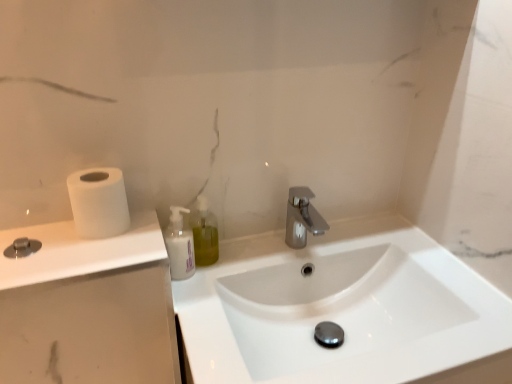
The height and width of the screenshot is (384, 512). Find the location of `translucent plastic soap dispenser at center`. translucent plastic soap dispenser at center is located at coordinates (204, 233).

Measure the distance between point (286, 243) and camera.

Point (286, 243) and camera are 3.32 feet apart.

Where is `white matte toilet paper at left`? This screenshot has height=384, width=512. white matte toilet paper at left is located at coordinates (98, 202).

Is polished chrome faucet at center next to white matte bottle at center?

polished chrome faucet at center is not next to white matte bottle at center, and they're not touching.

Can you confirm if polished chrome faucet at center is smaller than white matte bottle at center?

No.

Considering the sizes of objects polished chrome faucet at center and white matte bottle at center in the image provided, who is shorter, polished chrome faucet at center or white matte bottle at center?

Standing shorter between the two is polished chrome faucet at center.

Image resolution: width=512 pixels, height=384 pixels. Find the location of `tap directly beneath the white matte bottle at center (from a real-world perspective)`. tap directly beneath the white matte bottle at center (from a real-world perspective) is located at coordinates (302, 218).

You are a GUI agent. You are given a task and a screenshot of the screen. Output one action in this format:
    pyautogui.click(x=<x>, y=<y>)
    Task: Click on the sink that appears below the white matte bottle at center (from a real-world perspective)
    
    Given the screenshot: What is the action you would take?
    pyautogui.click(x=343, y=310)

Is white glossy sink at center facing towards white matte bottle at center?

No, white glossy sink at center is not aimed at white matte bottle at center.

Is white glossy sink at center bigger than white matte bottle at center?

Yes.

Can you confirm if white glossy sink at center is thinner than white matte bottle at center?

No.

Who is taller, polished chrome faucet at center or white glossy sink at center?

Standing taller between the two is white glossy sink at center.

The height and width of the screenshot is (384, 512). I want to click on tap behind the white glossy sink at center, so click(x=302, y=218).

Does point (300, 238) come in front of point (194, 333)?

No, it is behind (194, 333).

From a real-world perspective, is polished chrome faucet at center above or below white glossy sink at center?

Clearly, from a real-world perspective, polished chrome faucet at center is above white glossy sink at center.

Between white matte toilet paper at left and white matte countertop at left, which one has larger width?

white matte countertop at left is wider.

From the image's perspective, does white matte toilet paper at left appear lower than white matte countertop at left?

Actually, white matte toilet paper at left appears above white matte countertop at left in the image.

Considering the sizes of white matte toilet paper at left and white matte countertop at left in the image, is white matte toilet paper at left taller or shorter than white matte countertop at left?

Clearly, white matte toilet paper at left is shorter compared to white matte countertop at left.

Does white matte countertop at left appear on the left side of white matte bottle at center?

Yes.

Looking at this image, is white matte countertop at left inside or outside of white matte bottle at center?

white matte countertop at left lies outside white matte bottle at center.

Where is `mouthwash above the white matte countertop at left (from a real-world perspective)`? mouthwash above the white matte countertop at left (from a real-world perspective) is located at coordinates (179, 245).

Considering the sizes of white matte countertop at left and white matte bottle at center in the image, is white matte countertop at left bigger or smaller than white matte bottle at center?

Considering their sizes, white matte countertop at left takes up more space than white matte bottle at center.

Can you confirm if white matte bottle at center is bigger than translucent plastic soap dispenser at center?

Yes, white matte bottle at center is bigger than translucent plastic soap dispenser at center.

Considering the relative positions of white matte bottle at center and translucent plastic soap dispenser at center in the image provided, is white matte bottle at center to the left or to the right of translucent plastic soap dispenser at center?

In the image, white matte bottle at center appears on the left side of translucent plastic soap dispenser at center.

From a real-world perspective, between white matte bottle at center and translucent plastic soap dispenser at center, who is vertically higher?

translucent plastic soap dispenser at center, from a real-world perspective.

Between polished chrome faucet at center and white matte countertop at left, which one has smaller size?

polished chrome faucet at center.

From the image's perspective, would you say polished chrome faucet at center is positioned over white matte countertop at left?

Yes, from the image's perspective, polished chrome faucet at center is on top of white matte countertop at left.

Is point (293, 207) closer to camera compared to point (67, 312)?

No, (293, 207) is further to viewer.

Where is `tap that is behind the white matte bottle at center`? tap that is behind the white matte bottle at center is located at coordinates (302, 218).

What are the coordinates of `sink directly beneath the white matte bottle at center (from a real-world perspective)` in the screenshot? It's located at (343, 310).

When comparing their distances from white matte bottle at center, does white matte toilet paper at left or white glossy sink at center seem further?

white glossy sink at center.

Looking at the image, which one is located further to polished chrome faucet at center, white glossy sink at center or white matte countertop at left?

white matte countertop at left is further to polished chrome faucet at center.

Looking at this image, from the image, which object appears to be farther from white matte countertop at left, white glossy sink at center or translucent plastic soap dispenser at center?

white glossy sink at center.

Looking at the image, which one is located further to polished chrome faucet at center, translucent plastic soap dispenser at center or white glossy sink at center?

white glossy sink at center lies further to polished chrome faucet at center than the other object.

From the image, which object appears to be farther from white matte toilet paper at left, polished chrome faucet at center or translucent plastic soap dispenser at center?

Among the two, polished chrome faucet at center is located further to white matte toilet paper at left.

Which object lies nearer to the anchor point translucent plastic soap dispenser at center, white matte bottle at center or polished chrome faucet at center?

Based on the image, white matte bottle at center appears to be nearer to translucent plastic soap dispenser at center.

Looking at the image, which one is located closer to polished chrome faucet at center, translucent plastic soap dispenser at center or white matte countertop at left?

translucent plastic soap dispenser at center is closer to polished chrome faucet at center.

Looking at this image, from the image, which object appears to be nearer to white matte toilet paper at left, white matte countertop at left or white matte bottle at center?

white matte bottle at center lies closer to white matte toilet paper at left than the other object.

Where is `tap between white matte countertop at left and white glossy sink at center`? tap between white matte countertop at left and white glossy sink at center is located at coordinates click(302, 218).

The height and width of the screenshot is (384, 512). I want to click on mouthwash situated between white matte toilet paper at left and white glossy sink at center from left to right, so click(x=179, y=245).

Find the location of `toilet paper between white matte countertop at left and white glossy sink at center in the horizontal direction`. toilet paper between white matte countertop at left and white glossy sink at center in the horizontal direction is located at coordinates (98, 202).

Find the location of `mouthwash between white matte toilet paper at left and translucent plastic soap dispenser at center`. mouthwash between white matte toilet paper at left and translucent plastic soap dispenser at center is located at coordinates (179, 245).